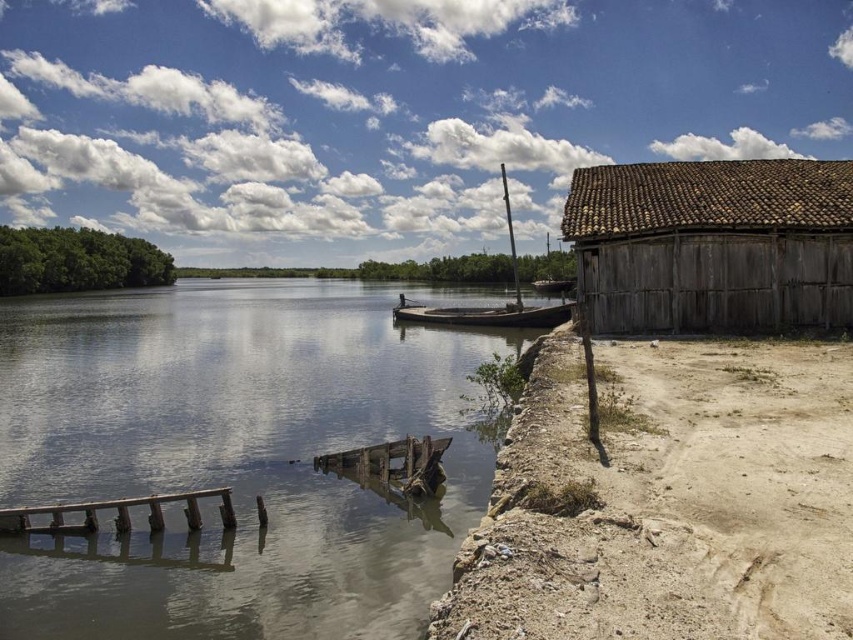
Question: Which point is farther from the camera taking this photo?

Choices:
 (A) (143, 502)
 (B) (561, 289)
 (C) (280, 625)
 (D) (408, 449)

Answer: (B)

Question: Observing the image, what is the correct spatial positioning of wooden sailboat at center in reference to rusty metal boat at center?

Choices:
 (A) below
 (B) above

Answer: (B)

Question: Is brown tiled roof at right in front of brown wooden dock at lower left?

Choices:
 (A) yes
 (B) no

Answer: (B)

Question: Which point is closer to the camera?

Choices:
 (A) (190, 525)
 (B) (775, 560)
 (C) (68, 304)

Answer: (B)

Question: Which object appears closest to the camera in this image?

Choices:
 (A) wooden sailboat at center
 (B) rusty wood dock at lower center

Answer: (B)

Question: Does rusty wood dock at lower center appear over rusty metal boat at center?

Choices:
 (A) yes
 (B) no

Answer: (B)